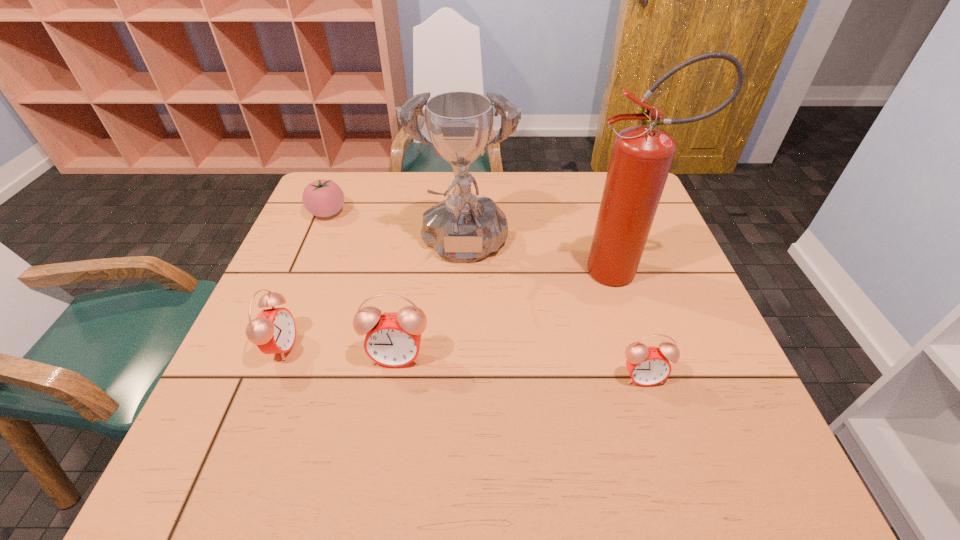
In order to click on fire extinguisher that is at the right edge in this screenshot , I will do `click(642, 155)`.

Identify the location of object that is at the far left corner. (323, 198).

Locate an element on the screen. The image size is (960, 540). object that is at the near right corner is located at coordinates (647, 365).

Locate an element on the screen. The height and width of the screenshot is (540, 960). vacant space at the far edge of the desktop is located at coordinates (372, 211).

You are a GUI agent. You are given a task and a screenshot of the screen. Output one action in this format:
    pyautogui.click(x=<x>, y=<y>)
    Task: Click on the free spot at the near edge of the desktop
    Image resolution: width=960 pixels, height=540 pixels.
    Given the screenshot: What is the action you would take?
    pyautogui.click(x=304, y=399)

Find the location of a particular element. This screenshot has height=540, width=960. free space at the left edge of the desktop is located at coordinates (329, 290).

In the image, there is a desktop. At what (x,y) coordinates should I click in order to perform the action: click on vacant space at the right edge. Please return your answer as a coordinate pair (x, y). Looking at the image, I should click on [660, 270].

The height and width of the screenshot is (540, 960). I want to click on vacant region at the near right corner of the desktop, so click(x=731, y=386).

I want to click on free space between the tomato and the award, so click(x=396, y=231).

You are a GUI agent. You are given a task and a screenshot of the screen. Output one action in this format:
    pyautogui.click(x=<x>, y=<y>)
    Task: Click on the free spot between the shortest object and the second tallest alarm clock
    
    Given the screenshot: What is the action you would take?
    pyautogui.click(x=304, y=279)